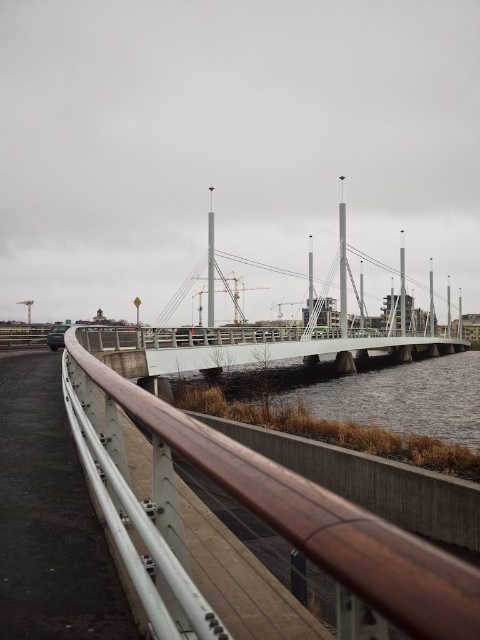
You are driving a metallic silver car at left and want to cross the white concrete bridge at center. Based on their sizes, can the car safely pass under the bridge?

The white concrete bridge at center has a larger size compared to the metallic silver car at left, so the car should be able to safely pass under the bridge since the bridge is bigger and provides enough clearance.

You are standing on the white concrete bridge at center and want to move towards the brown metallic rail at lower left. Which direction should you walk to reach it?

You should walk to the left to reach the brown metallic rail at lower left since it is positioned to the left of the white concrete bridge at center.